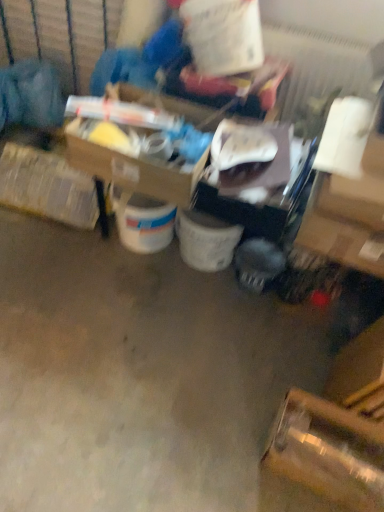
What do you see at coordinates (133, 167) in the screenshot?
I see `cardboard box at center` at bounding box center [133, 167].

I want to click on cardboard box at center, so click(133, 167).

Where is `cardboard box at center`? The height and width of the screenshot is (512, 384). cardboard box at center is located at coordinates tap(133, 167).